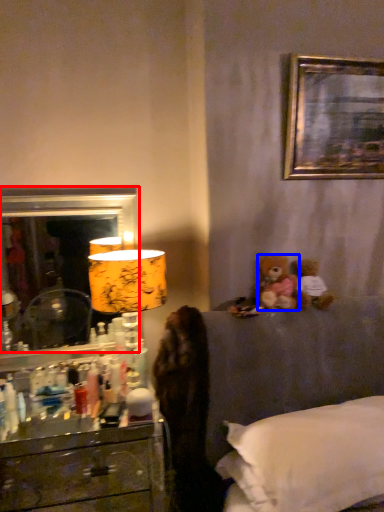
Question: Which object is closer to the camera taking this photo, mirror (highlighted by a red box) or teddy bear (highlighted by a blue box)?

Choices:
 (A) mirror
 (B) teddy bear

Answer: (B)